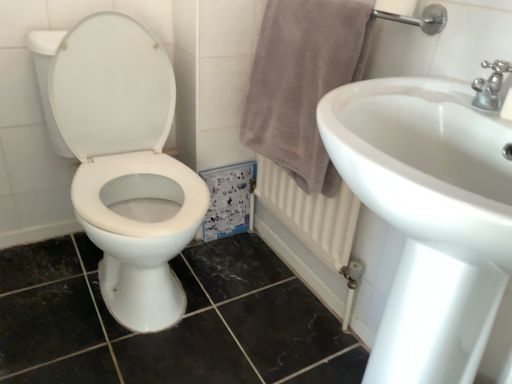
You are a GUI agent. You are given a task and a screenshot of the screen. Output one action in this format:
    pyautogui.click(x=<x>, y=<y>)
    Task: Click on the vacant region under white glossy toilet at left (from a real-world perspective)
    The image size is (512, 384).
    Given the screenshot: What is the action you would take?
    pyautogui.click(x=113, y=289)